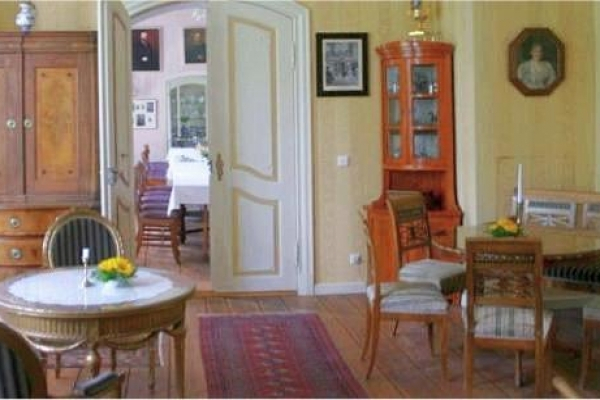
Locate an element on the screen. This screenshot has height=400, width=600. cabinet is located at coordinates (438, 220).